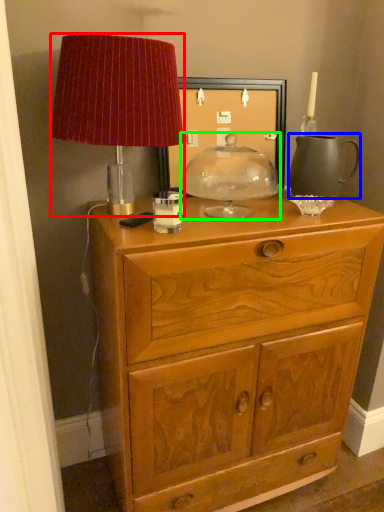
Question: Considering the real-world distances, which object is closest to lamp (highlighted by a red box)? tea pot (highlighted by a blue box) or candle holder (highlighted by a green box).

Choices:
 (A) tea pot
 (B) candle holder

Answer: (B)